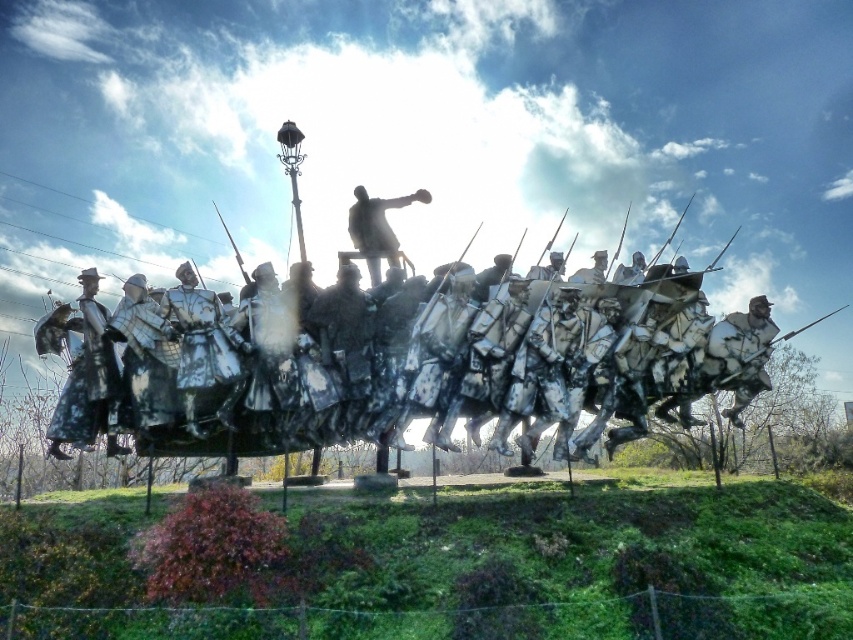
You are a tour guide explaining the sculpture to visitors. You want to mention the distance between the bronze statue at center and the silver metallic spear at right. What do you tell them?

The bronze statue at center and the silver metallic spear at right are 26.52 meters apart from each other.

You are an art student analyzing the sculpture. You notice two central figures, the metallic silver soldiers at center and the bronze statue at center. Which one do you think is bigger?

The metallic silver soldiers at center is larger in size than the bronze statue at center.